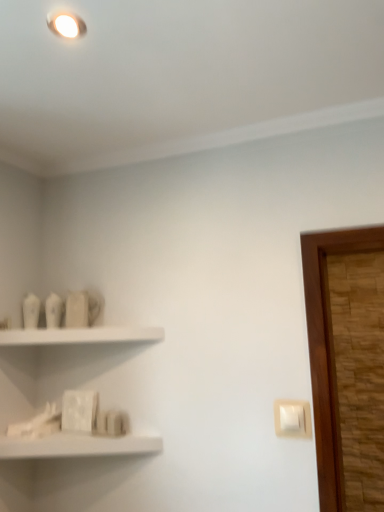
Question: Does white matte shelf at lower left, which is the 2th shelf from top to bottom, have a greater height compared to white plastic light switch at lower right?

Choices:
 (A) no
 (B) yes

Answer: (A)

Question: Does white matte shelf at lower left, which is the 2th shelf from top to bottom, appear on the left side of white plastic light switch at lower right?

Choices:
 (A) yes
 (B) no

Answer: (A)

Question: Does white matte shelf at lower left, which is the 2th shelf from top to bottom, turn towards white plastic light switch at lower right?

Choices:
 (A) yes
 (B) no

Answer: (B)

Question: Is white plastic light switch at lower right inside white matte shelf at lower left, the first shelf when ordered from bottom to top?

Choices:
 (A) no
 (B) yes

Answer: (A)

Question: Is white matte shelf at lower left, the first shelf when ordered from bottom to top, shorter than white plastic light switch at lower right?

Choices:
 (A) no
 (B) yes

Answer: (B)

Question: Considering the relative sizes of white matte shelf at lower left, which is the 2th shelf from top to bottom, and white plastic light switch at lower right in the image provided, is white matte shelf at lower left, which is the 2th shelf from top to bottom, wider than white plastic light switch at lower right?

Choices:
 (A) no
 (B) yes

Answer: (B)

Question: From a real-world perspective, is white matte shelf at upper left, the 1th shelf in the top-to-bottom sequence, below white matte shelf at lower left, the first shelf when ordered from bottom to top?

Choices:
 (A) yes
 (B) no

Answer: (B)

Question: Is white matte shelf at upper left, the 1th shelf in the top-to-bottom sequence, behind white matte shelf at lower left, the first shelf when ordered from bottom to top?

Choices:
 (A) yes
 (B) no

Answer: (A)

Question: Is white matte shelf at upper left, the 1th shelf in the top-to-bottom sequence, facing towards white matte shelf at lower left, the first shelf when ordered from bottom to top?

Choices:
 (A) yes
 (B) no

Answer: (B)

Question: From the image's perspective, would you say white matte shelf at upper left, the 1th shelf in the top-to-bottom sequence, is shown under white matte shelf at lower left, the first shelf when ordered from bottom to top?

Choices:
 (A) no
 (B) yes

Answer: (A)

Question: From a real-world perspective, is white matte shelf at upper left, the 1th shelf in the top-to-bottom sequence, over white matte shelf at lower left, the first shelf when ordered from bottom to top?

Choices:
 (A) no
 (B) yes

Answer: (B)

Question: Does white matte shelf at upper left, placed as the second shelf when sorted from bottom to top, have a smaller size compared to white matte shelf at lower left, the first shelf when ordered from bottom to top?

Choices:
 (A) no
 (B) yes

Answer: (B)

Question: Could you tell me if white plastic light switch at lower right is facing white matte shelf at lower left, the first shelf when ordered from bottom to top?

Choices:
 (A) no
 (B) yes

Answer: (A)